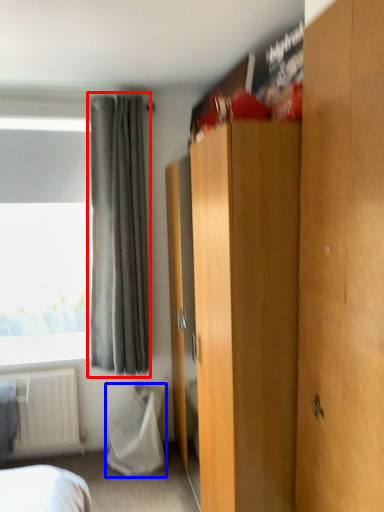
Question: Which object is further to the camera taking this photo, curtain (highlighted by a red box) or blanket (highlighted by a blue box)?

Choices:
 (A) curtain
 (B) blanket

Answer: (B)